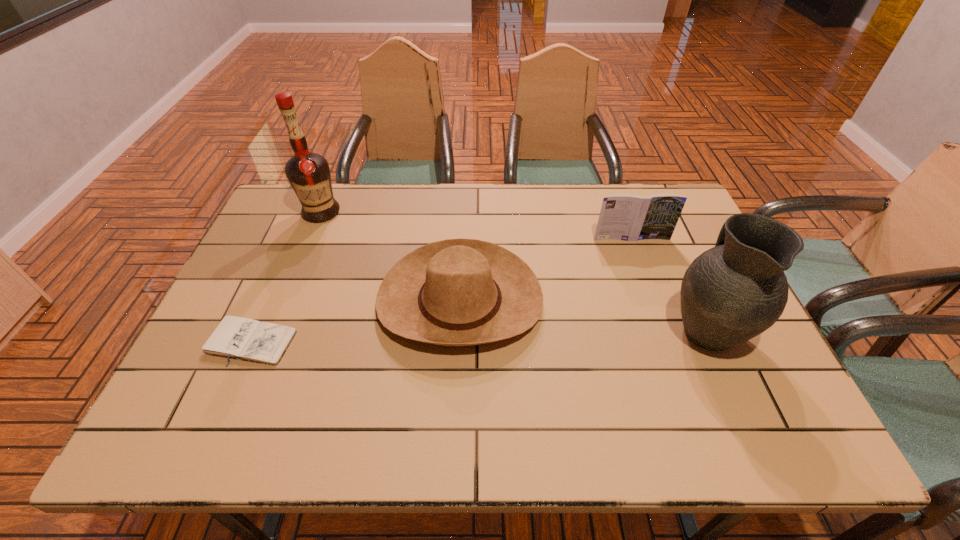
Where is `free space located on the front cover of the second farthest object`? This screenshot has height=540, width=960. free space located on the front cover of the second farthest object is located at coordinates (648, 285).

Locate an element on the screen. The image size is (960, 540). blank space located 0.150m on the front-facing side of the third object from left to right is located at coordinates (455, 418).

Where is `vacant space located on the back of the shortest object`? The height and width of the screenshot is (540, 960). vacant space located on the back of the shortest object is located at coordinates (288, 254).

At what (x,y) coordinates should I click in order to perform the action: click on object at the far edge. Please return your answer as a coordinate pair (x, y). This screenshot has height=540, width=960. Looking at the image, I should click on [x=308, y=173].

Where is `liquor present at the left edge`? This screenshot has height=540, width=960. liquor present at the left edge is located at coordinates (308, 173).

Where is `notebook that is at the left edge`? Image resolution: width=960 pixels, height=540 pixels. notebook that is at the left edge is located at coordinates (235, 337).

The image size is (960, 540). Find the location of `pitcher that is positioned at the right edge`. pitcher that is positioned at the right edge is located at coordinates (731, 293).

In order to click on book that is at the right edge in this screenshot , I will do `click(629, 217)`.

I want to click on object at the far left corner, so click(308, 173).

You are a GUI agent. You are given a task and a screenshot of the screen. Output one action in this format:
    pyautogui.click(x=<x>, y=<y>)
    Task: Click on the free location at the far edge
    Image resolution: width=960 pixels, height=540 pixels.
    Given the screenshot: What is the action you would take?
    pyautogui.click(x=598, y=197)